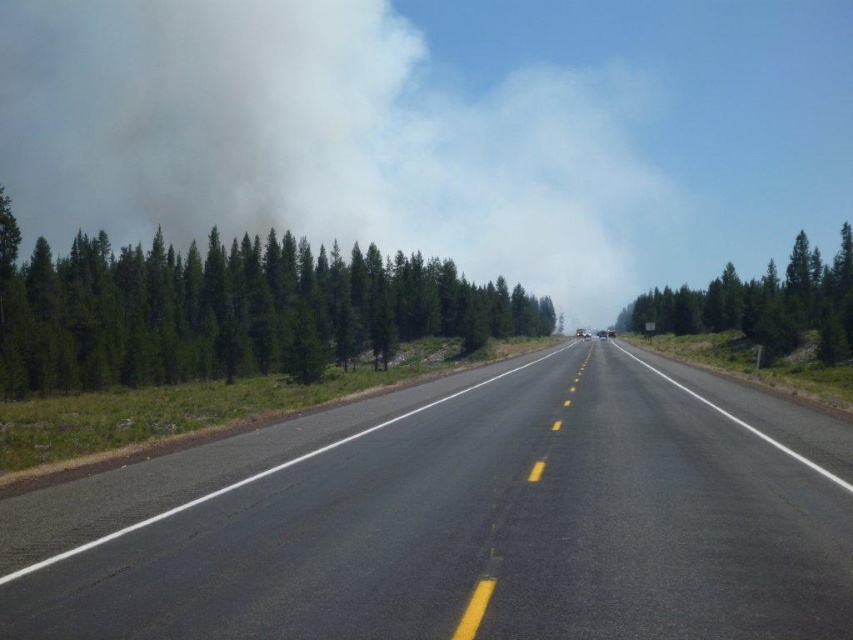
Who is taller, black asphalt highway at center or white smoke at upper center?

white smoke at upper center

Describe the element at coordinates (462, 518) in the screenshot. Image resolution: width=853 pixels, height=640 pixels. I see `black asphalt highway at center` at that location.

Locate an element on the screen. The height and width of the screenshot is (640, 853). black asphalt highway at center is located at coordinates (462, 518).

Describe the element at coordinates (229, 310) in the screenshot. The height and width of the screenshot is (640, 853). I see `green textured trees at left` at that location.

Is green textured trees at left bigger than green textured tree at right?

Yes, green textured trees at left is bigger than green textured tree at right.

This screenshot has height=640, width=853. Identify the location of green textured trees at left. (229, 310).

Does black asphalt highway at center appear on the right side of green textured trees at left?

Indeed, black asphalt highway at center is positioned on the right side of green textured trees at left.

Between point (138, 557) and point (296, 353), which one is positioned in front?

Point (138, 557)

In order to click on black asphalt highway at center in this screenshot , I will do `click(462, 518)`.